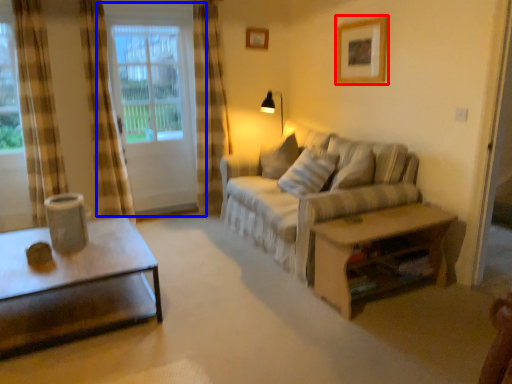
Question: Which object is further to the camera taking this photo, picture frame (highlighted by a red box) or window (highlighted by a blue box)?

Choices:
 (A) picture frame
 (B) window

Answer: (B)